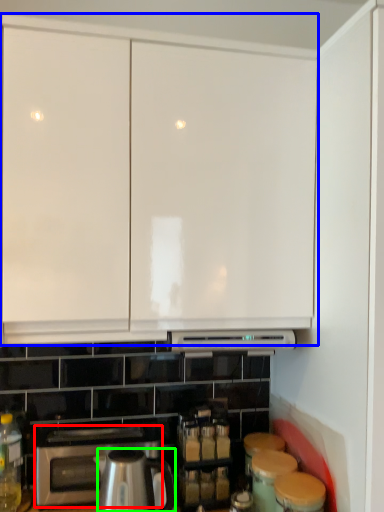
Question: Considering the real-world distances, which object is closest to home appliance (highlighted by a red box)? cabinetry (highlighted by a blue box) or kitchen appliance (highlighted by a green box).

Choices:
 (A) cabinetry
 (B) kitchen appliance

Answer: (B)